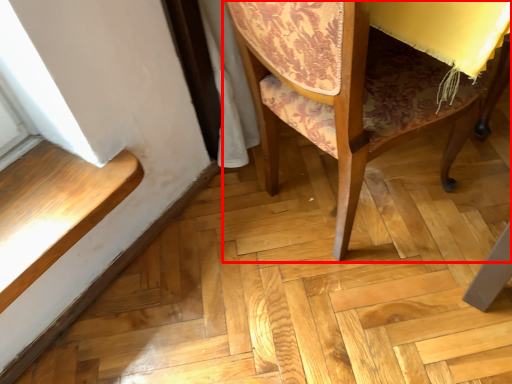
Question: Where is chair (annotated by the red box) located in relation to stairwell in the image?

Choices:
 (A) left
 (B) right

Answer: (B)